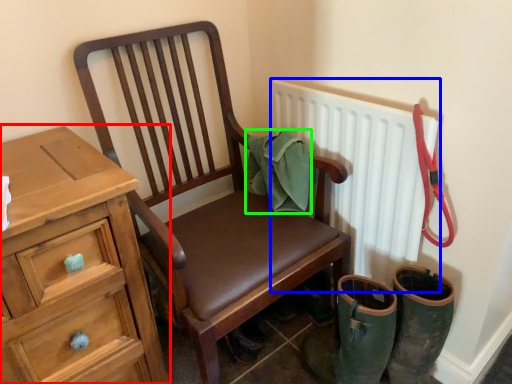
Question: Considering the real-world distances, which object is farthest from chest of drawers (highlighted by a red box)? radiator (highlighted by a blue box) or material (highlighted by a green box)?

Choices:
 (A) radiator
 (B) material

Answer: (A)